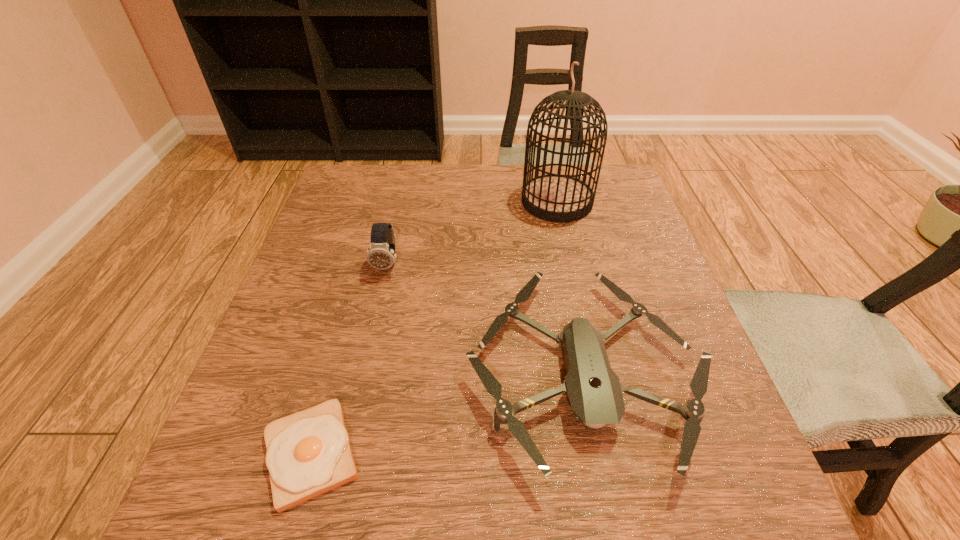
Locate an element on the screen. drone that is at the near edge is located at coordinates (594, 390).

Image resolution: width=960 pixels, height=540 pixels. In order to click on toast at the near edge in this screenshot , I will do `click(308, 453)`.

The width and height of the screenshot is (960, 540). What are the coordinates of `object present at the left edge` in the screenshot? It's located at (308, 453).

This screenshot has height=540, width=960. I want to click on birdcage that is at the right edge, so click(x=559, y=198).

This screenshot has height=540, width=960. In order to click on drone at the right edge in this screenshot , I will do `click(594, 390)`.

I want to click on object at the near left corner, so click(308, 453).

Image resolution: width=960 pixels, height=540 pixels. I want to click on object that is at the far right corner, so click(559, 198).

The image size is (960, 540). Find the location of `object at the near right corner`. object at the near right corner is located at coordinates (594, 390).

Identify the location of vacant area at the far edge of the desktop. (484, 177).

Where is `free space at the left edge of the desktop`? free space at the left edge of the desktop is located at coordinates (240, 418).